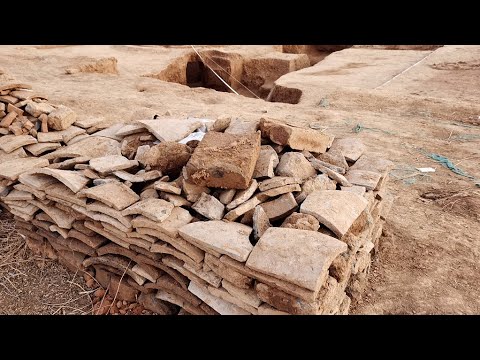
Find the location of `cables`. cables is located at coordinates (216, 72), (248, 88).